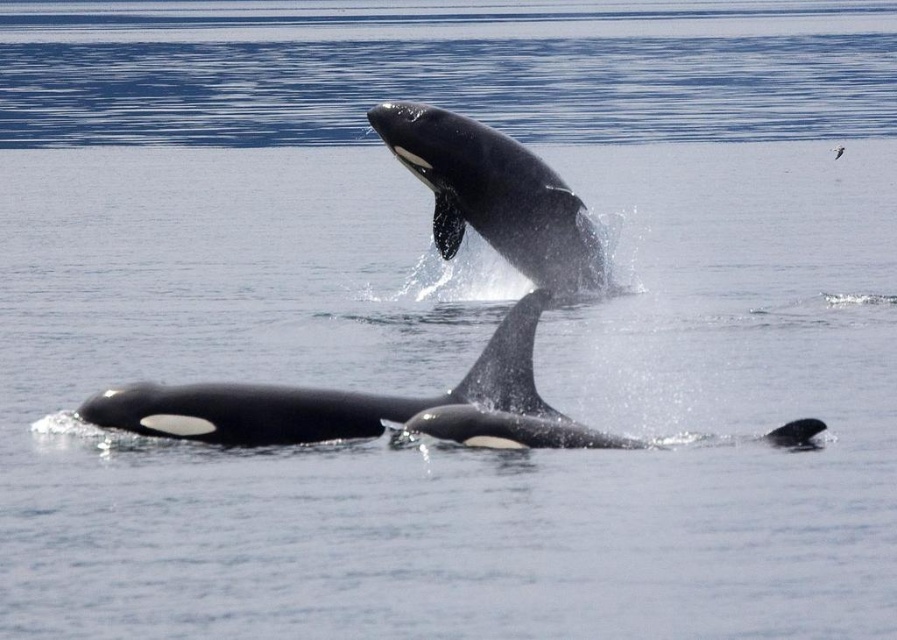
Based on the photo, you are a marine biologist observing the orcas in the image. You notice two distinct orcas at the center. Which one is smaller in size between the black smooth dolphin at center and the black smooth whale at center?

The black smooth dolphin at center is smaller than the black smooth whale at center.

You are a marine biologist observing the orcas in the water. You notice two points marked in the scene. The first point is at coordinate point(172, 428) and the second point is at coordinate point(543, 186). Which point is closer to the orca that is midair?

Point(172, 428) is closer to the orca that is midair because it is in front of point(543, 186), which is further back.

You are a marine biologist observing the orcas. You notice the black smooth dolphin at center and the black smooth whale at center. How far apart are these two marine mammals from each other?

The black smooth dolphin at center is 13.65 meters from black smooth whale at center.